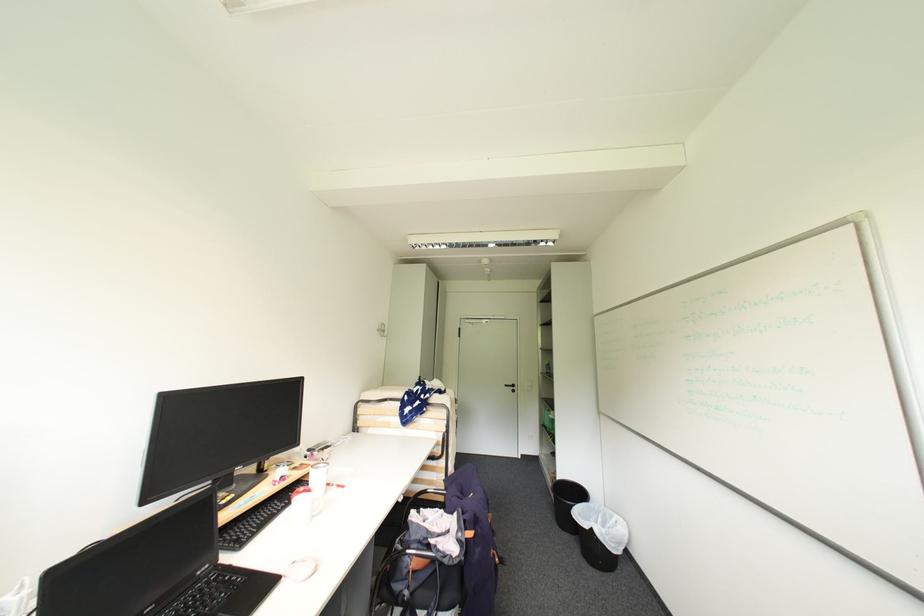
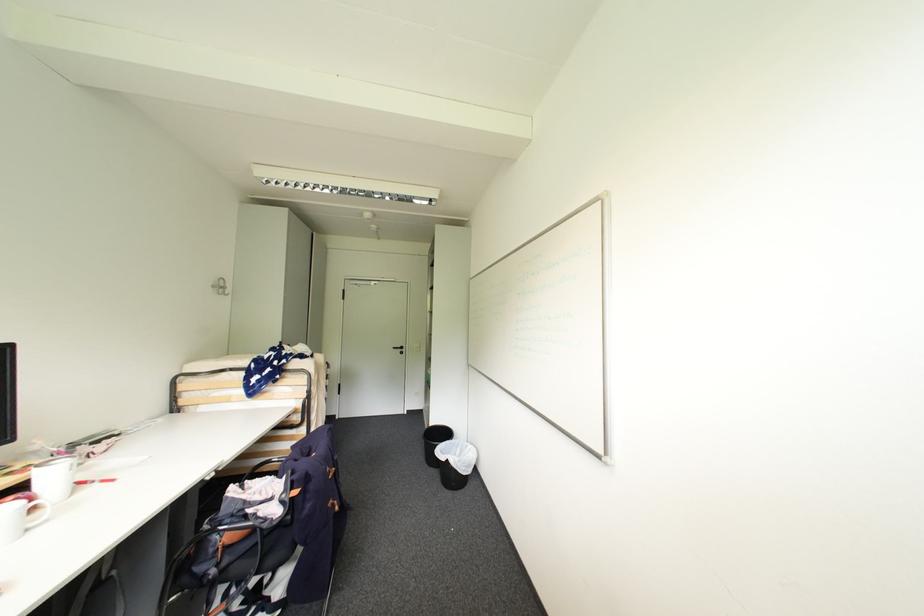
Find the pixel in the second image that matches [591,505] in the first image.

(456, 442)